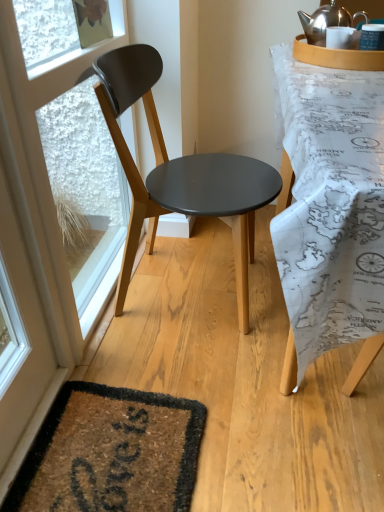
Question: Does white plastic window frame at left have a smaller size compared to matte black chair at center?

Choices:
 (A) yes
 (B) no

Answer: (A)

Question: Considering the relative sizes of white plastic window frame at left and matte black chair at center in the image provided, is white plastic window frame at left shorter than matte black chair at center?

Choices:
 (A) no
 (B) yes

Answer: (B)

Question: Does white plastic window frame at left have a greater width compared to matte black chair at center?

Choices:
 (A) yes
 (B) no

Answer: (B)

Question: From a real-world perspective, is white plastic window frame at left positioned over matte black chair at center based on gravity?

Choices:
 (A) no
 (B) yes

Answer: (A)

Question: Is white plastic window frame at left closer to the viewer compared to matte black chair at center?

Choices:
 (A) yes
 (B) no

Answer: (B)

Question: From the image's perspective, is map-patterned fabric at right above or below white plastic window frame at left?

Choices:
 (A) below
 (B) above

Answer: (B)

Question: Considering the positions of map-patterned fabric at right and white plastic window frame at left in the image, is map-patterned fabric at right taller or shorter than white plastic window frame at left?

Choices:
 (A) short
 (B) tall

Answer: (B)

Question: Would you say map-patterned fabric at right is inside or outside white plastic window frame at left?

Choices:
 (A) outside
 (B) inside

Answer: (A)

Question: Considering the positions of point (365, 126) and point (100, 136), is point (365, 126) closer or farther from the camera than point (100, 136)?

Choices:
 (A) closer
 (B) farther

Answer: (A)

Question: From the image's perspective, is matte black chair at center located above or below map-patterned fabric at right?

Choices:
 (A) below
 (B) above

Answer: (B)

Question: Is matte black chair at center spatially inside map-patterned fabric at right, or outside of it?

Choices:
 (A) inside
 (B) outside

Answer: (B)

Question: Looking at the image, does matte black chair at center seem bigger or smaller compared to map-patterned fabric at right?

Choices:
 (A) big
 (B) small

Answer: (B)

Question: Is point (144, 207) positioned closer to the camera than point (294, 136)?

Choices:
 (A) farther
 (B) closer

Answer: (A)

Question: In the image, is map-patterned fabric at right positioned in front of or behind matte black chair at center?

Choices:
 (A) front
 (B) behind

Answer: (A)

Question: From a real-world perspective, relative to matte black chair at center, is map-patterned fabric at right vertically above or below?

Choices:
 (A) above
 (B) below

Answer: (B)